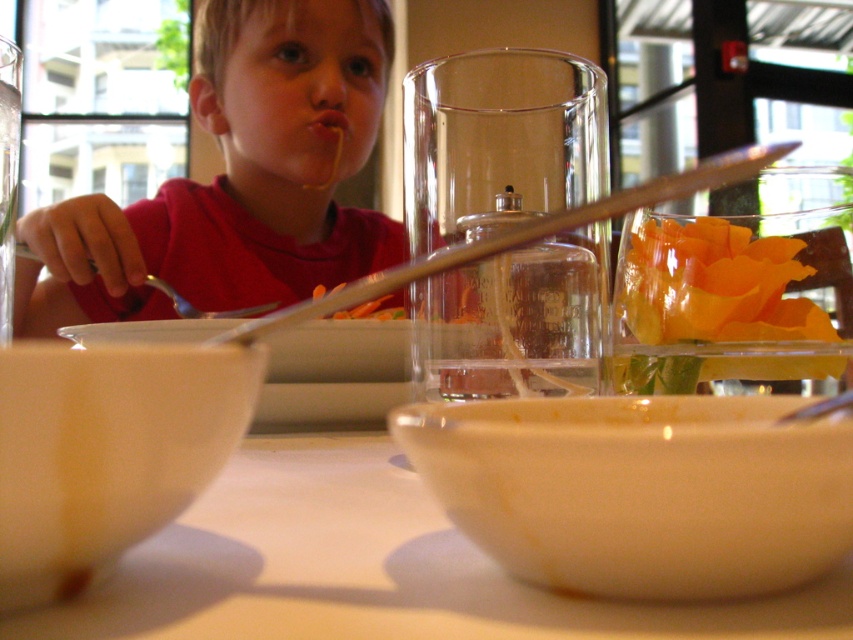
You are a photographer trying to focus on the glass container between the two white bowls. According to the image, where is the point at coordinates point (x=236, y=179) located?

The point at coordinates point (x=236, y=179) is located on the matte red shirt at upper left.

You are a photographer trying to capture a closeup of the white matte bowl at lower left without the matte red shirt at upper left blocking the view. Is this possible given their positions?

The matte red shirt at upper left is further to the viewer than the white matte bowl at lower left, so the shirt is closer to the camera and would block the view of the bowl. Therefore, it is not possible to capture a clear closeup of the white matte bowl at lower left without the matte red shirt at upper left obstructing it.

You are a chef preparing a dish and need to choose between the orange translucent chips at right and the clear glass chopstick at upper center for a garnish. Which item is narrower?

The orange translucent chips at right has a lesser width compared to the clear glass chopstick at upper center, so the orange translucent chips at right is narrower.